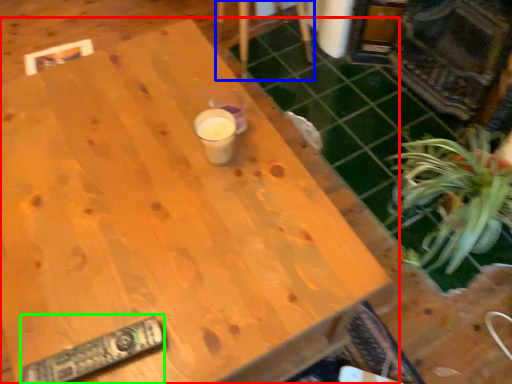
Question: Based on their relative distances, which object is farther from table (highlighted by a red box)? Choose from chair (highlighted by a blue box) and remote (highlighted by a green box).

Choices:
 (A) chair
 (B) remote

Answer: (A)